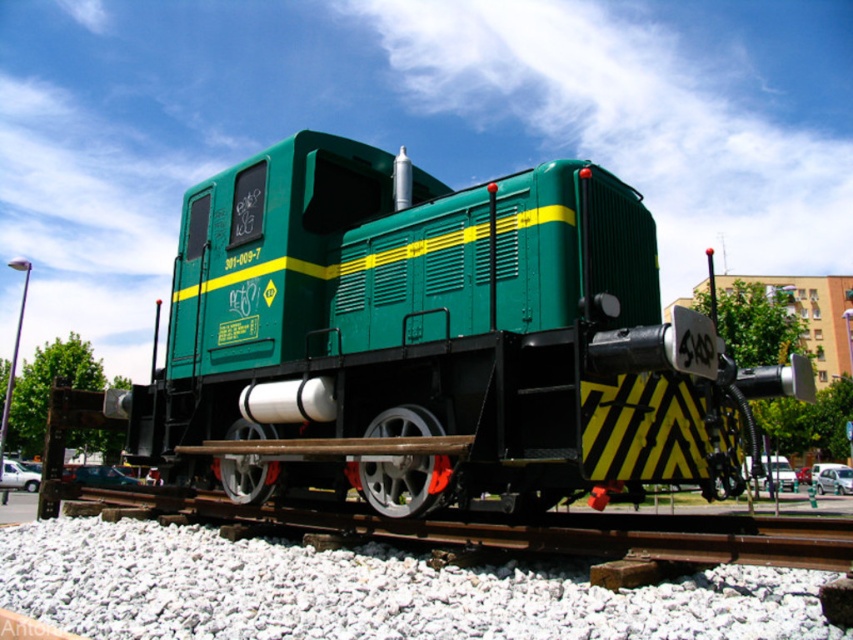
You are a railway inspector checking the alignment of the green matte train at center and the smooth metal train track at center. Based on the scene, is the train positioned correctly on the tracks?

The green matte train at center is located above smooth metal train track at center, so it is positioned correctly on the tracks.

In the scene shown: You are standing in front of the green diesel locomotive and notice two points marked on its side. The first point is at coordinates point (611, 340) and the second is at point (576, 609). Which point is closer to you?

Point (611, 340) is closer to you because it is further to the viewer than point (576, 609).